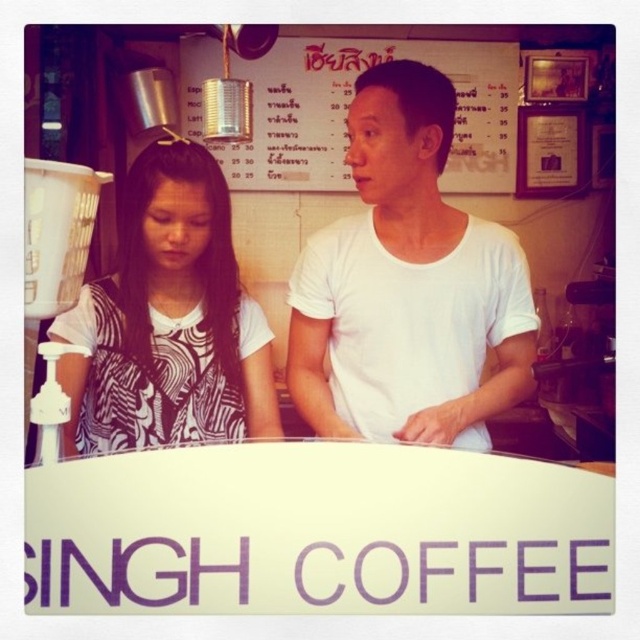
You are a customer in the coffee shop and want to sit at the counter. The counter has two seats. You want to sit next to the person wearing the white printed shirt at left. Which seat should you choose?

You should choose the seat to the right of the white printed shirt at left because they are sitting at the counter next to each other.

You are a customer at the coffee shop and want to know which of the two points, point (118,369) or point (304,44), is closer to you. Based on the scene description, which point is nearer?

Point (118,369) is closer to the viewer than point (304,44).

You are a customer at the coffee shop and want to place your order. You notice the white matte shirt at center and the metallic tin can at upper center. Which object is narrower when viewed from the front?

The white matte shirt at center is thinner than the metallic tin can at upper center, so the white matte shirt at center is narrower when viewed from the front.